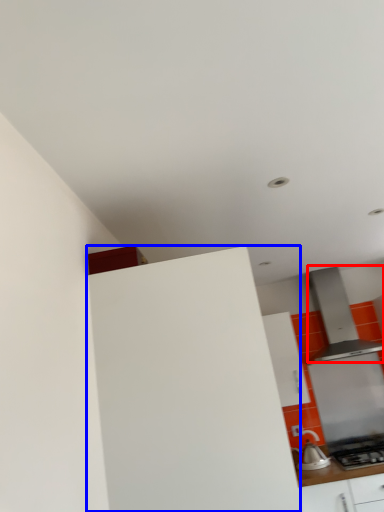
Question: Which object is further to the camera taking this photo, home appliance (highlighted by a red box) or cabinetry (highlighted by a blue box)?

Choices:
 (A) home appliance
 (B) cabinetry

Answer: (A)